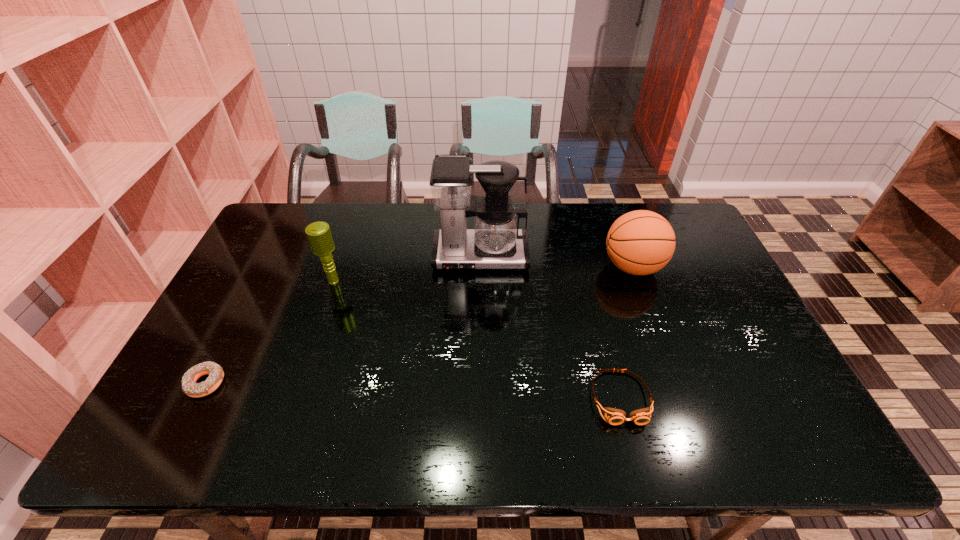
You are a GUI agent. You are given a task and a screenshot of the screen. Output one action in this format:
    pyautogui.click(x=<x>, y=<y>)
    Task: Click on the coffee maker
    
    Given the screenshot: What is the action you would take?
    pyautogui.click(x=496, y=242)

Where is `the third object from left to right`? This screenshot has width=960, height=540. the third object from left to right is located at coordinates (496, 242).

Where is `microphone`? The height and width of the screenshot is (540, 960). microphone is located at coordinates (319, 235).

At what (x,y) coordinates should I click in order to perform the action: click on basketball. Please return your answer as a coordinate pair (x, y). The width and height of the screenshot is (960, 540). Looking at the image, I should click on (641, 242).

Where is `goggles`? goggles is located at coordinates (614, 416).

Where is `doughnut`? Image resolution: width=960 pixels, height=540 pixels. doughnut is located at coordinates point(189,386).

The width and height of the screenshot is (960, 540). I want to click on the shortest object, so click(x=189, y=386).

At what (x,y) coordinates should I click in order to perform the action: click on free space located 0.270m at the front of the coffee maker where the controls are located. Please return your answer as a coordinate pair (x, y). The height and width of the screenshot is (540, 960). Looking at the image, I should click on (480, 345).

Find the location of a particular element. This screenshot has width=960, height=540. vacant space located 0.080m on the front of the second object from left to right is located at coordinates (324, 309).

Locate an element on the screen. Image resolution: width=960 pixels, height=540 pixels. free region located 0.340m on the left of the basketball is located at coordinates (494, 267).